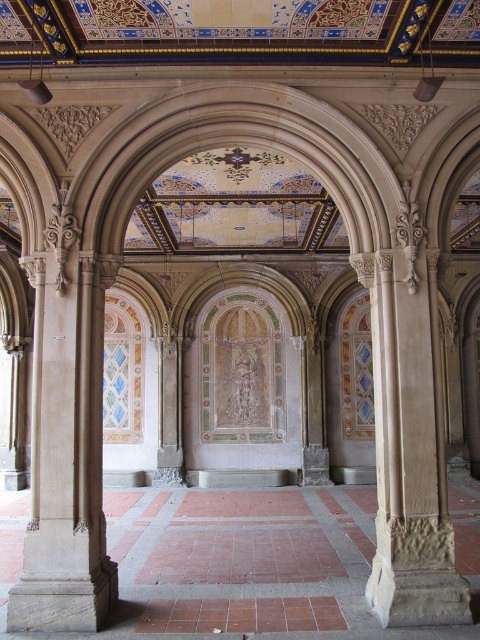
Who is positioned more to the left, smooth stone column at left or beige stone column at right?

From the viewer's perspective, smooth stone column at left appears more on the left side.

Who is higher up, smooth stone column at left or beige stone column at right?

smooth stone column at left is higher up.

Between point (16, 592) and point (395, 481), which one is positioned in front?

Positioned in front is point (16, 592).

This screenshot has height=640, width=480. What are the coordinates of `smooth stone column at left` in the screenshot? It's located at (66, 444).